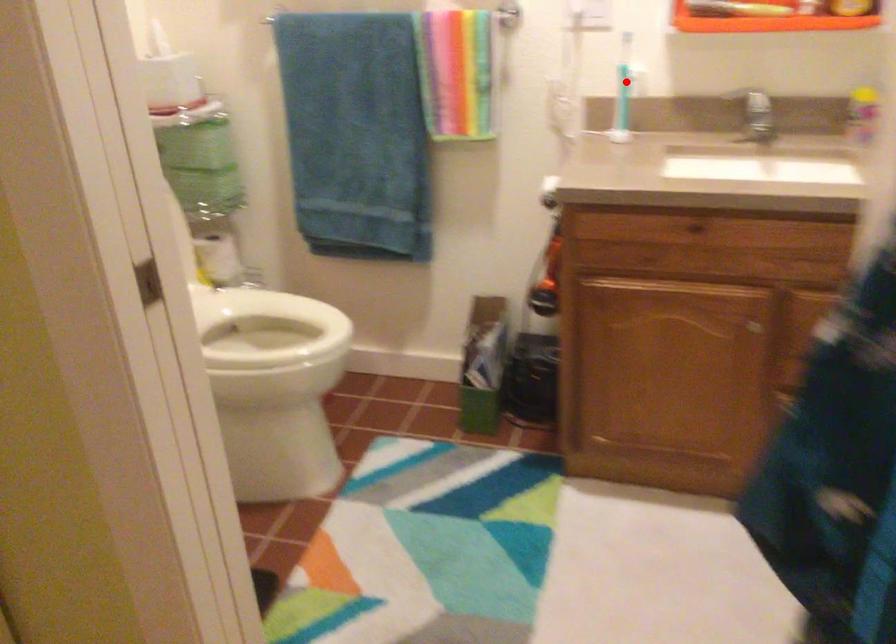
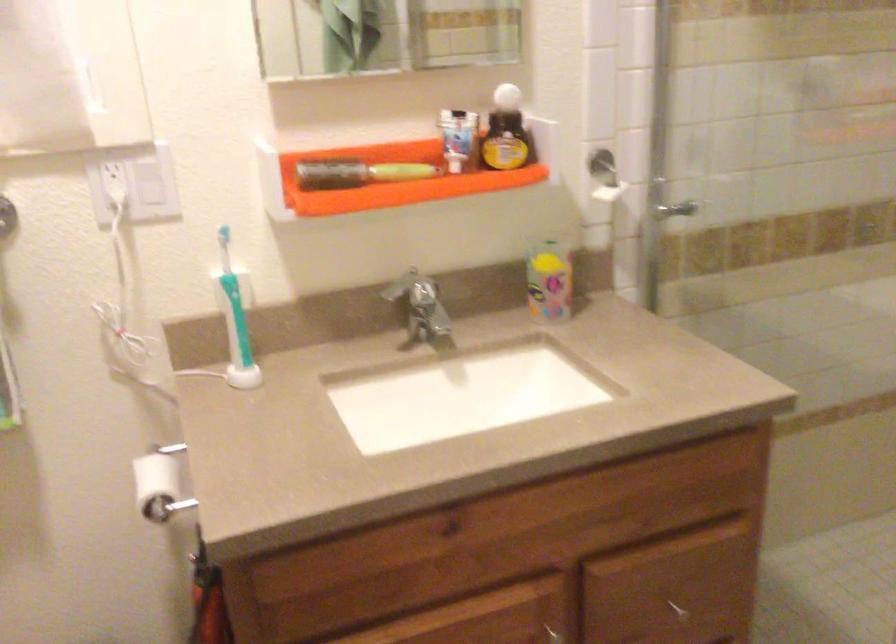
In the second image, find the point that corresponds to the highlighted location in the first image.

(234, 304)